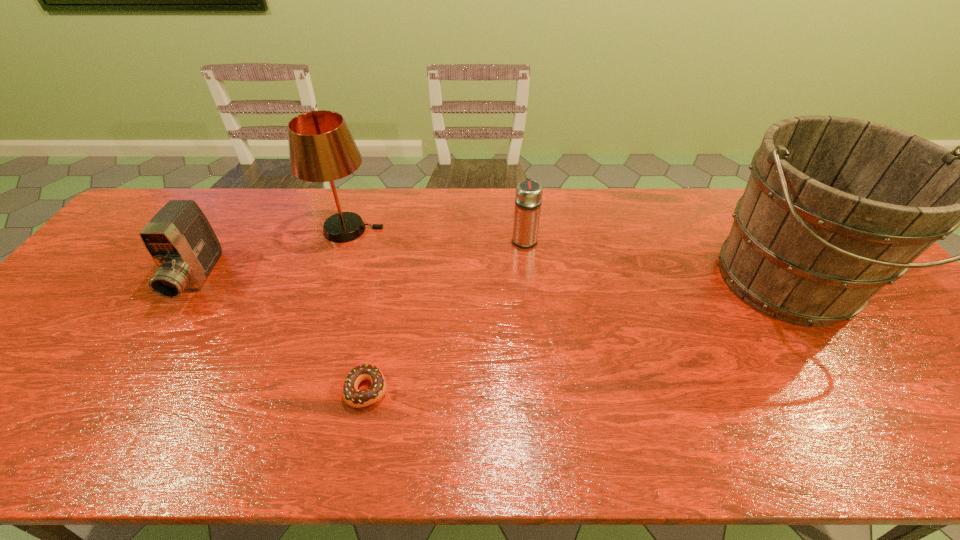
At what (x,y) coordinates should I click in order to perform the action: click on the rightmost object. Please return your answer as a coordinate pair (x, y). The width and height of the screenshot is (960, 540). Looking at the image, I should click on (835, 208).

At what (x,y) coordinates should I click in order to perform the action: click on lampshade. Please return your answer as a coordinate pair (x, y). The height and width of the screenshot is (540, 960). Looking at the image, I should click on tap(321, 148).

The width and height of the screenshot is (960, 540). Find the location of `camcorder`. camcorder is located at coordinates (181, 241).

The height and width of the screenshot is (540, 960). Identify the location of the second object from right to left. (528, 198).

Where is `the nearest object`? the nearest object is located at coordinates (352, 396).

This screenshot has height=540, width=960. In order to click on the shortest object in this screenshot , I will do `click(352, 396)`.

I want to click on vacant position located on the handle side of the bucket, so click(857, 384).

Locate an element on the screen. The width and height of the screenshot is (960, 540). vacant space located on the front-facing side of the lampshade is located at coordinates (510, 230).

Find the location of a particular element. The image size is (960, 540). vacant space located 0.100m at the front of the leftmost object, highlighting the lens is located at coordinates [x=157, y=342].

You are a GUI agent. You are given a task and a screenshot of the screen. Output one action in this format:
    pyautogui.click(x=<x>, y=<y>)
    Task: Click on the vacant region located with a handle on the side of the second object from right to left
    The width and height of the screenshot is (960, 540).
    Given the screenshot: What is the action you would take?
    pyautogui.click(x=520, y=202)